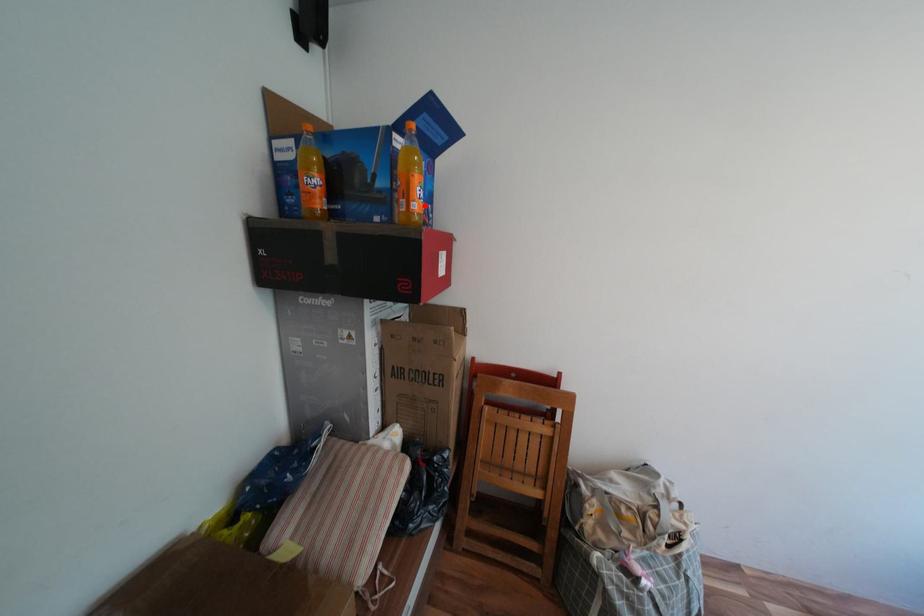
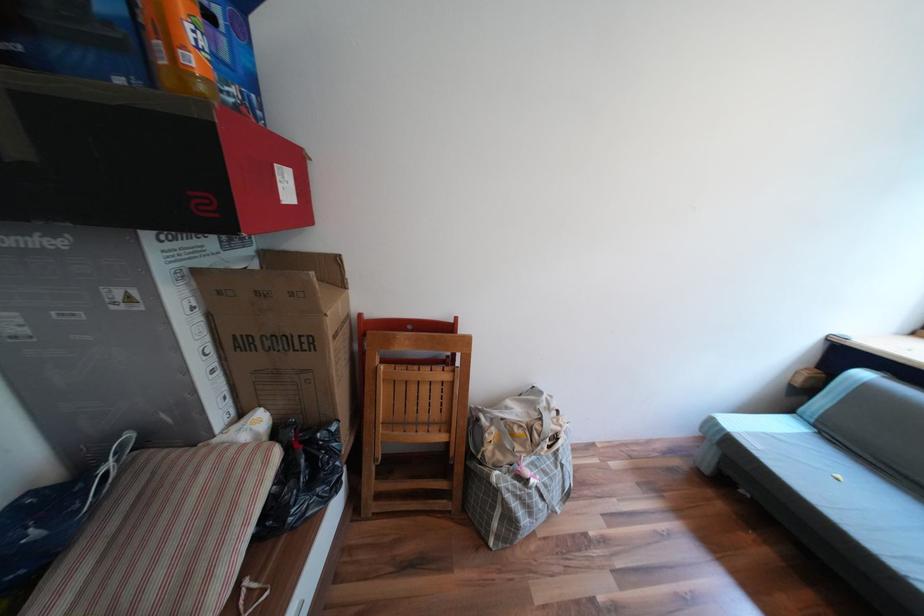
The point at the highlighted location is marked in the first image. Where is the corresponding point in the second image?

(201, 61)